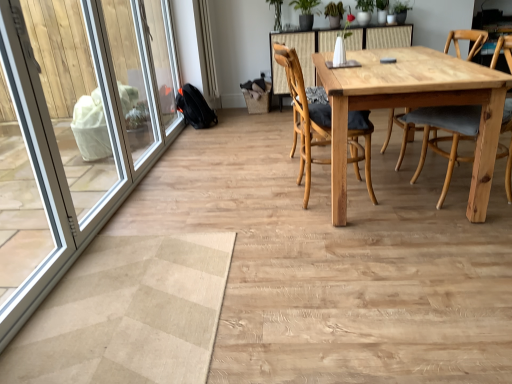
Question: Does point (278, 0) appear closer or farther from the camera than point (298, 97)?

Choices:
 (A) farther
 (B) closer

Answer: (A)

Question: In terms of height, does green leafy plant at upper center look taller or shorter compared to wooden chair at center, which is the first chair from left to right?

Choices:
 (A) short
 (B) tall

Answer: (A)

Question: Considering the real-world distances, which object is closest to the white plastic screen door at left?

Choices:
 (A) natural wood table at center
 (B) green leafy plant at upper center
 (C) light brown wood chair at center, the second chair when ordered from left to right
 (D) wooden chair at center, the 2th chair positioned from the right

Answer: (D)

Question: Which object is the farthest from the wooden chair at center, the 2th chair positioned from the right?

Choices:
 (A) natural wood table at center
 (B) green leafy plant at upper center
 (C) white plastic screen door at left
 (D) light brown wood chair at center, acting as the first chair starting from the right

Answer: (B)